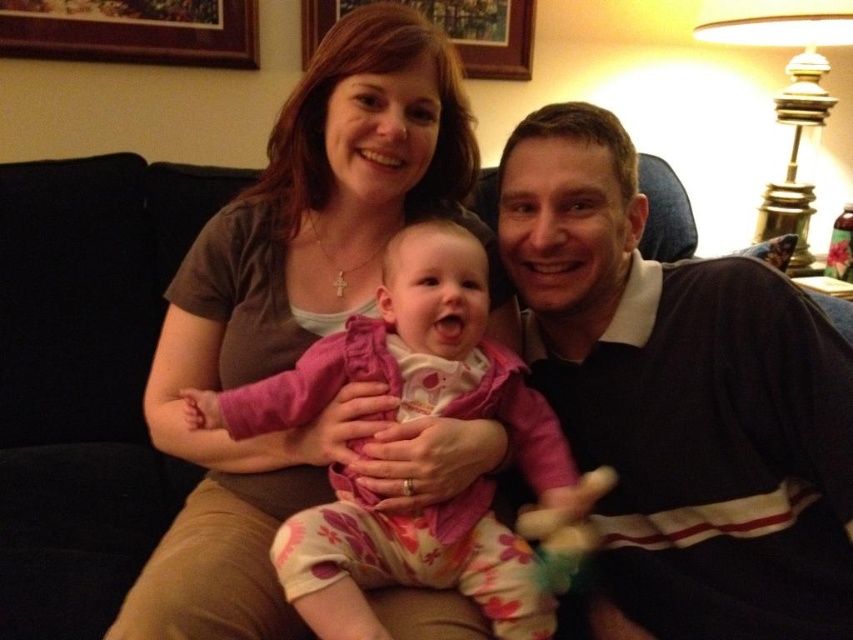
You are a photographer who wants to capture a closeup of the dark brown jersey at right. Where exactly should you focus your camera?

You should focus your camera at point 0.623 on the x axis and 0.800 on the y axis to capture the dark brown jersey at right.

You are a photographer setting up for a family photo. You need to ensure the pink fleece baby at center and the plush pink toy at center are visible in the frame. Given that the camera can only focus on objects above a certain height, which object is more likely to be in focus?

The pink fleece baby at center is taller than the plush pink toy at center, so the camera is more likely to focus on the pink fleece baby at center.

You are a photographer taking a picture of the family. You notice the pink fleece baby at center and the plush pink toy at center. Which one is closer to the camera?

The pink fleece baby at center is closer to the camera since it is in front of the plush pink toy at center.